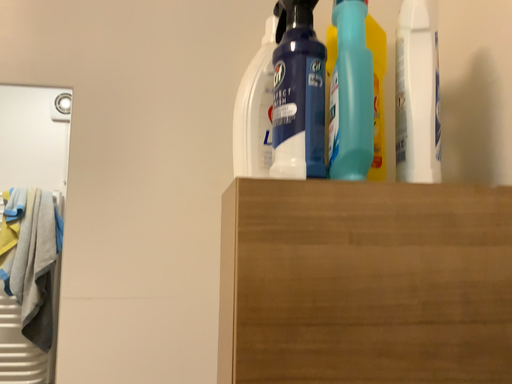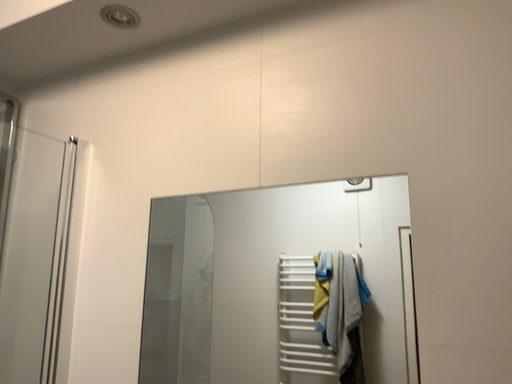
Question: Which way did the camera rotate in the video?

Choices:
 (A) rotated left
 (B) rotated right

Answer: (A)